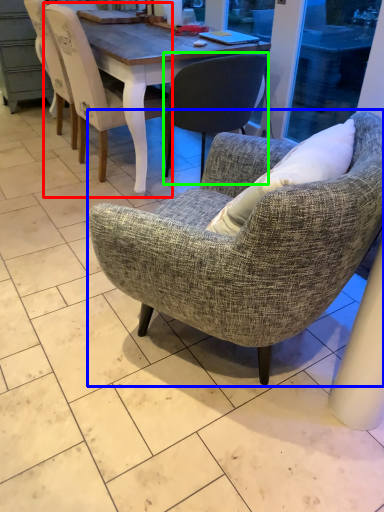
Question: Estimate the real-world distances between objects in this image. Which object is closer to chair (highlighted by a red box), chair (highlighted by a blue box) or chair (highlighted by a green box)?

Choices:
 (A) chair
 (B) chair

Answer: (B)